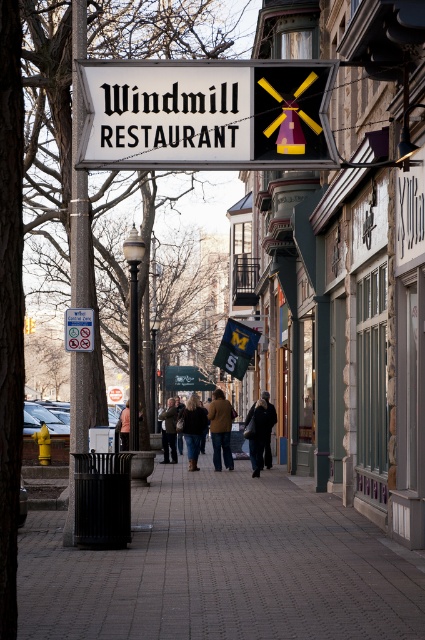
Between point (215, 412) and point (138, 417), which one is positioned in front?

Point (138, 417) is more forward.

Find the location of `brown leather jacket at center`. brown leather jacket at center is located at coordinates [221, 428].

Can you confirm if denim jacket at center is shorter than orange leather jacket at center?

In fact, denim jacket at center may be taller than orange leather jacket at center.

Measure the distance between denim jacket at center and orange leather jacket at center.

denim jacket at center is 7.62 feet from orange leather jacket at center.

Measure the distance between point [200,410] and camera.

The distance of point [200,410] from camera is 103.29 feet.

Where is `denim jacket at center`? denim jacket at center is located at coordinates (192, 428).

Is the position of matte black sign at upper center more distant than that of denim jacket at center?

No, it is in front of denim jacket at center.

Looking at this image, between matte black sign at upper center and denim jacket at center, which one is positioned lower?

denim jacket at center

Which is in front, point (272, 84) or point (197, 451)?

Point (272, 84) is in front.

Image resolution: width=425 pixels, height=640 pixels. What are the coordinates of `matte black sign at upper center` in the screenshot? It's located at (207, 115).